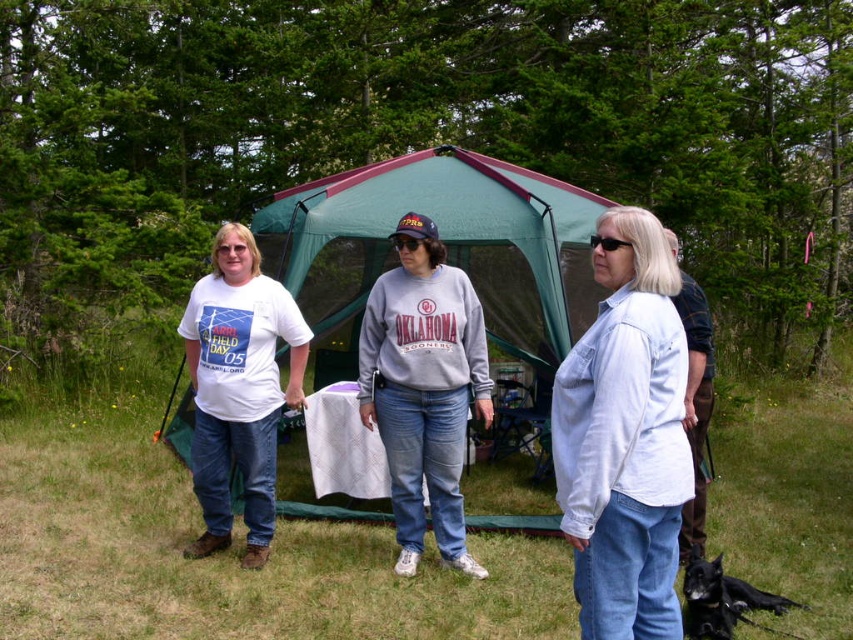
Which is behind, point (699, 289) or point (605, 237)?

Positioned behind is point (699, 289).

Does brown leather pants at right appear under black plastic sunglasses at center?

Yes, brown leather pants at right is below black plastic sunglasses at center.

Who is more distant from viewer, (682,316) or (624,246)?

The point (682,316) is behind.

Locate an element on the screen. The height and width of the screenshot is (640, 853). brown leather pants at right is located at coordinates (695, 404).

Does point (706, 422) come farther from viewer compared to point (416, 244)?

Yes, it is.

Measure the distance from brown leather pants at right to black matte cap at center.

brown leather pants at right is 5.37 feet away from black matte cap at center.

At what (x,y) coordinates should I click in order to perform the action: click on brown leather pants at right. Please return your answer as a coordinate pair (x, y). Looking at the image, I should click on (695, 404).

Where is `light blue denim jacket at center`? light blue denim jacket at center is located at coordinates (625, 440).

Is light blue denim jacket at center thinner than black matte cap at center?

In fact, light blue denim jacket at center might be wider than black matte cap at center.

The width and height of the screenshot is (853, 640). I want to click on light blue denim jacket at center, so [625, 440].